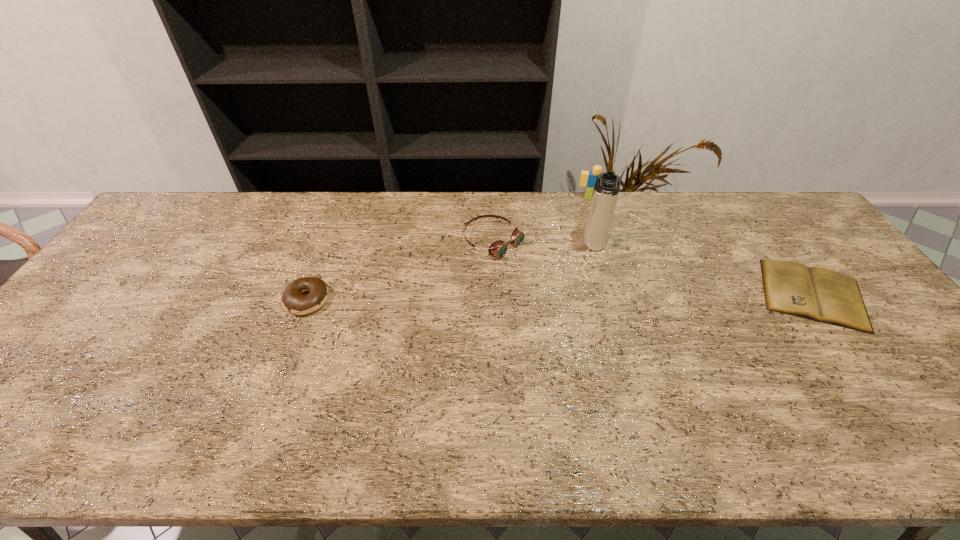
What are the coordinates of `object identified as the fourth closest to the leftmost object` in the screenshot? It's located at (820, 294).

Identify the location of vacant position in the image that satisfies the following two spatial constraints: 1. on the back side of the fourth shortest object; 2. on the left side of the goggles. (492, 198).

Locate an element on the screen. blank space that satisfies the following two spatial constraints: 1. on the back side of the Lego; 2. on the left side of the doughnut is located at coordinates (345, 198).

Where is `free location that satisfies the following two spatial constraints: 1. on the back side of the farthest object; 2. on the left side of the doughnut`? The image size is (960, 540). free location that satisfies the following two spatial constraints: 1. on the back side of the farthest object; 2. on the left side of the doughnut is located at coordinates (345, 198).

Find the location of a particular element. This screenshot has height=540, width=960. free space that satisfies the following two spatial constraints: 1. on the back side of the farthest object; 2. on the left side of the third tallest object is located at coordinates (492, 198).

This screenshot has width=960, height=540. I want to click on vacant area in the image that satisfies the following two spatial constraints: 1. on the front side of the farthest object; 2. on the left side of the rightmost object, so [621, 294].